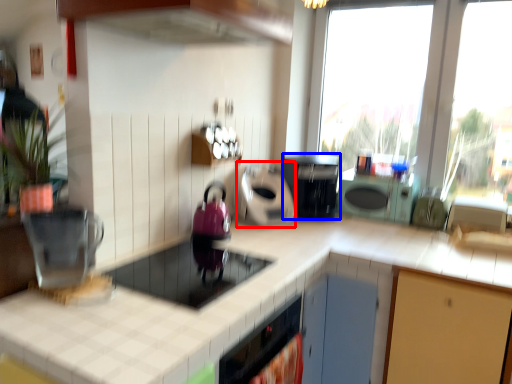
Question: Which object is closer to the camera taking this photo, appliance (highlighted by a red box) or kitchen appliance (highlighted by a blue box)?

Choices:
 (A) appliance
 (B) kitchen appliance

Answer: (A)